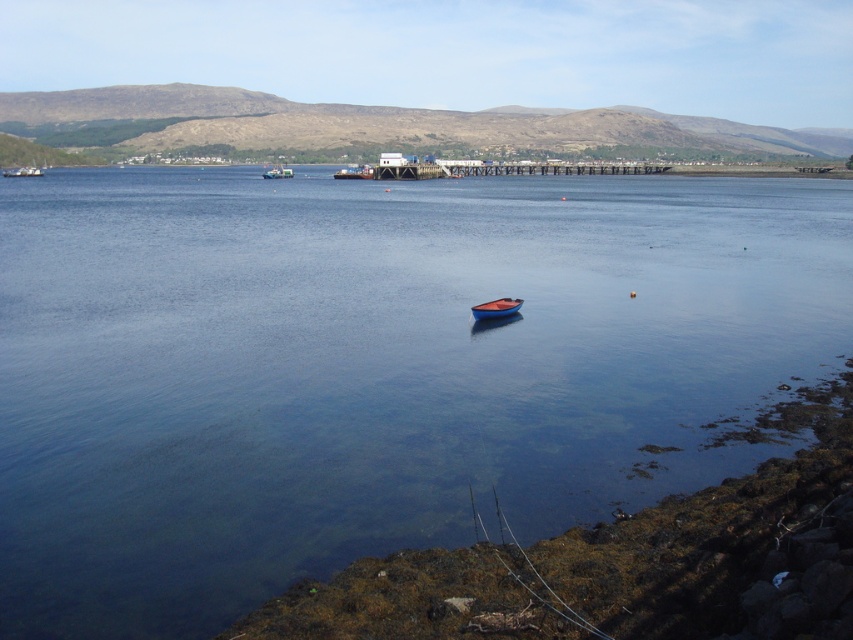
You are standing on the rocky shoreline and want to board the blue glossy boat at center and the metallic blue boat at center. Which boat do you need to walk towards first based on their positions relative to each other?

The blue glossy boat at center is located below the metallic blue boat at center, so you should walk towards the metallic blue boat at center first as it is higher up and closer to the shoreline.

You are standing at the shoreline in the image and want to reach the blue glossy boat at center. According to the coordinates provided, in which direction should you move relative to your current position?

The blue glossy boat at center is located at coordinates approximately 0.483 on the x axis and 0.581 on the y axis. Since you are at the shoreline, which is the lower part of the image, moving towards the boat would require moving upward along the y axis to reach it.

You are standing on the rocky shoreline and want to determine which object in the scene occupies a higher position relative to the horizon. Based on the clear blue water at center and the metallic silver boat at upper left, which one is higher?

The clear blue water at center has a greater height compared to the metallic silver boat at upper left, so the clear blue water at center is higher.